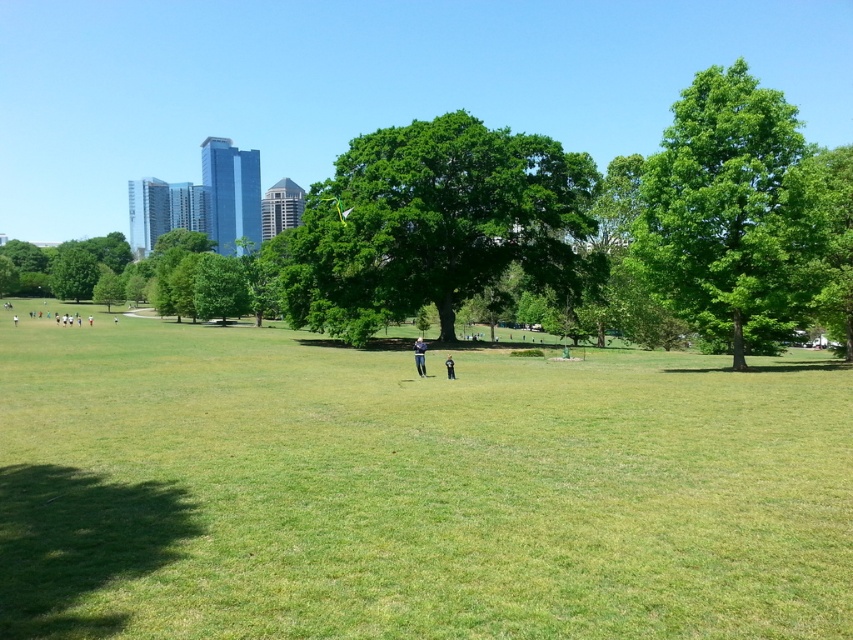
Question: Which object appears closest to the camera in this image?

Choices:
 (A) black fabric person at center
 (B) green grassy field at center
 (C) green leafy tree at right

Answer: (B)

Question: Can you confirm if green grassy field at center is positioned to the left of green leafy tree at center?

Choices:
 (A) yes
 (B) no

Answer: (A)

Question: Which of the following is the closest to the observer?

Choices:
 (A) green leafy tree at right
 (B) light blue denim jeans at center
 (C) black fabric person at center

Answer: (A)

Question: Observing the image, what is the correct spatial positioning of green leafy tree at center in reference to green leafy tree at right?

Choices:
 (A) left
 (B) right

Answer: (A)

Question: Is green grassy field at center behind light blue denim jeans at center?

Choices:
 (A) yes
 (B) no

Answer: (B)

Question: Which object is positioned farthest from the light blue denim jeans at center?

Choices:
 (A) green grassy field at center
 (B) green leafy tree at right
 (C) black fabric person at center

Answer: (B)